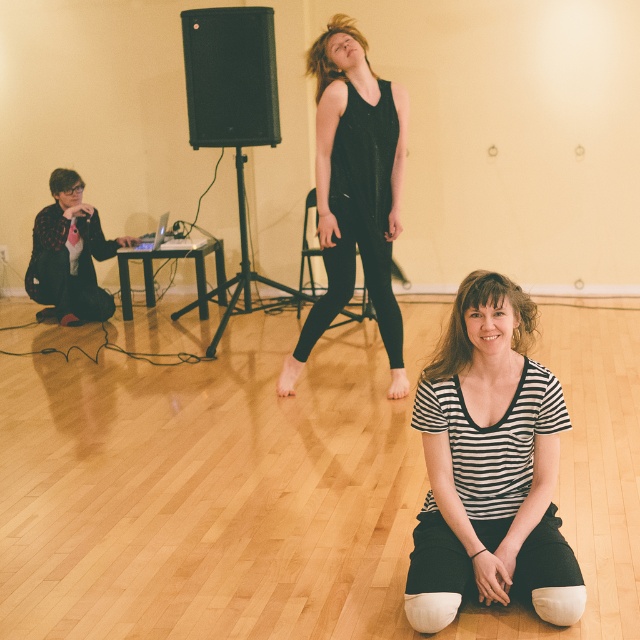
Is black striped shirt at lower center in front of black matte tank top at center?

That is True.

Is black striped shirt at lower center to the right of black matte tank top at center from the viewer's perspective?

Indeed, black striped shirt at lower center is positioned on the right side of black matte tank top at center.

The width and height of the screenshot is (640, 640). What are the coordinates of `black striped shirt at lower center` in the screenshot? It's located at (488, 465).

Which is above, black striped shirt at lower center or flannel shirt at left?

flannel shirt at left is above.

Does black striped shirt at lower center have a lesser height compared to flannel shirt at left?

In fact, black striped shirt at lower center may be taller than flannel shirt at left.

Where is `black striped shirt at lower center`? This screenshot has width=640, height=640. black striped shirt at lower center is located at coordinates (488, 465).

Can you confirm if black matte tank top at center is positioned below flannel shirt at left?

No, black matte tank top at center is not below flannel shirt at left.

Image resolution: width=640 pixels, height=640 pixels. What do you see at coordinates (355, 189) in the screenshot? I see `black matte tank top at center` at bounding box center [355, 189].

I want to click on black matte tank top at center, so click(355, 189).